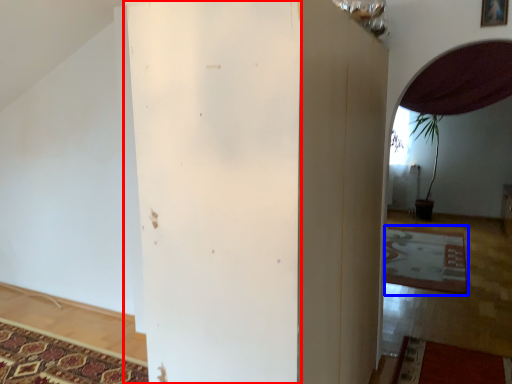
Question: Which object is further to the camera taking this photo, pillar (highlighted by a red box) or mat (highlighted by a blue box)?

Choices:
 (A) pillar
 (B) mat

Answer: (B)